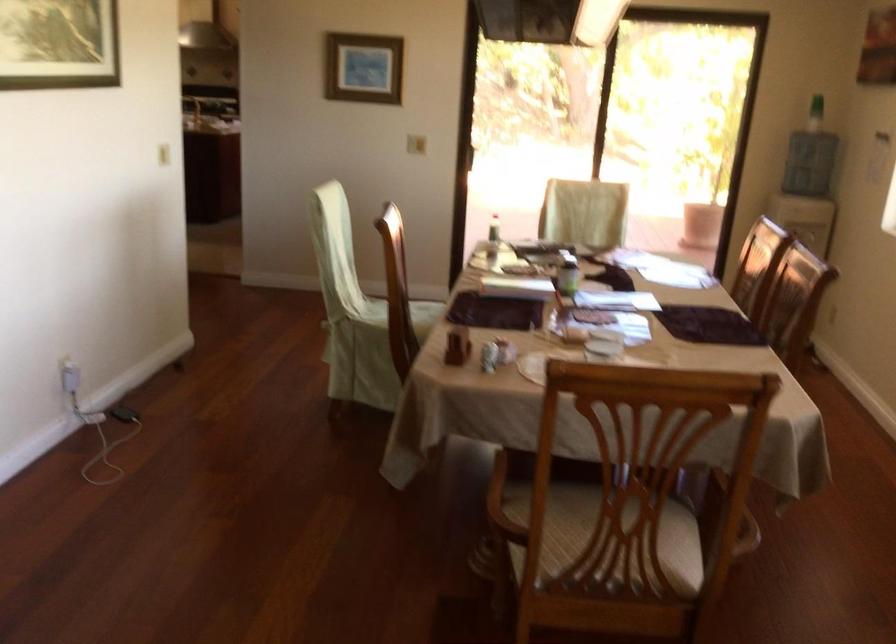
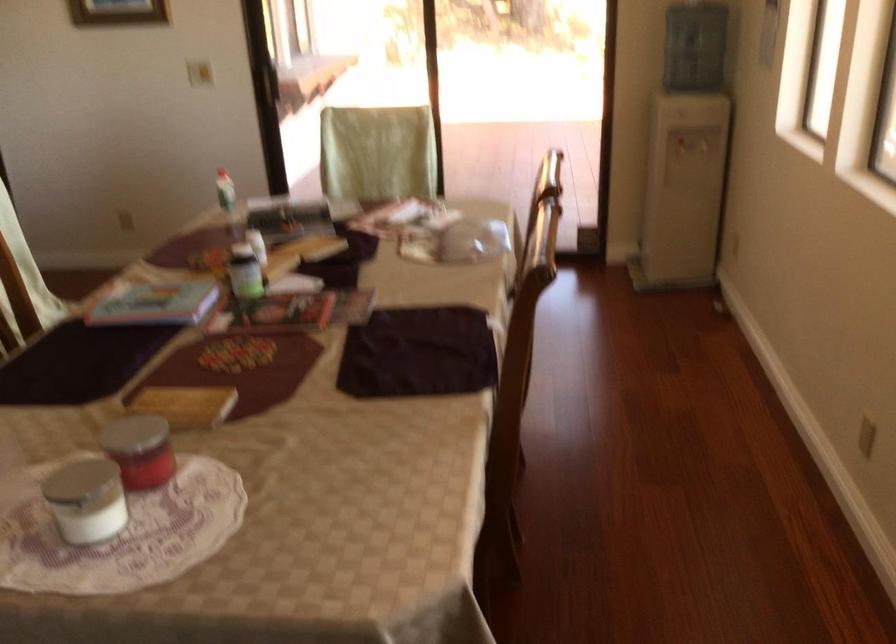
Locate, in the second image, the point that corresponds to the point at 607,355 in the first image.

(85, 500)